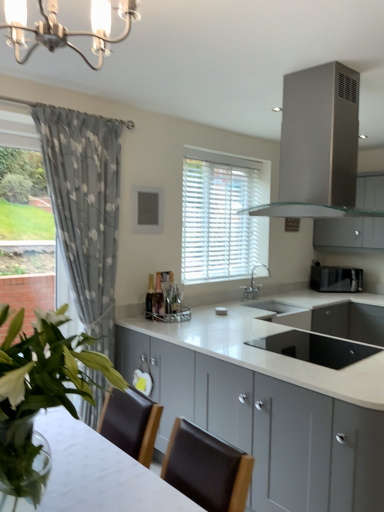
Question: From the image's perspective, does stainless steel range hood at upper center appear lower than black matte toaster at right, which is the second appliance in front-to-back order?

Choices:
 (A) yes
 (B) no

Answer: (B)

Question: Is stainless steel range hood at upper center shorter than black matte toaster at right, the 2th appliance positioned from the bottom?

Choices:
 (A) yes
 (B) no

Answer: (B)

Question: Is stainless steel range hood at upper center smaller than black matte toaster at right, which is the second appliance in front-to-back order?

Choices:
 (A) no
 (B) yes

Answer: (A)

Question: Does stainless steel range hood at upper center have a lesser width compared to black matte toaster at right, the second appliance positioned from the left?

Choices:
 (A) no
 (B) yes

Answer: (A)

Question: Is black matte toaster at right, the first appliance positioned from the top, completely or partially inside stainless steel range hood at upper center?

Choices:
 (A) no
 (B) yes

Answer: (A)

Question: Is stainless steel range hood at upper center taller than black matte toaster at right, the first appliance positioned from the top?

Choices:
 (A) no
 (B) yes

Answer: (B)

Question: Is black matte toaster at right, which is the second appliance in front-to-back order, facing away from white glossy cabinets at center, the first cabinetry when ordered from front to back?

Choices:
 (A) yes
 (B) no

Answer: (B)

Question: Is black matte toaster at right, which is the second appliance in front-to-back order, behind white glossy cabinets at center, the 1th cabinetry from the left?

Choices:
 (A) yes
 (B) no

Answer: (A)

Question: Can you confirm if black matte toaster at right, which is the 1th appliance from back to front, is thinner than white glossy cabinets at center, the first cabinetry when ordered from front to back?

Choices:
 (A) yes
 (B) no

Answer: (A)

Question: From a real-world perspective, is black matte toaster at right, the second appliance positioned from the left, below white glossy cabinets at center, which is the 2th cabinetry from top to bottom?

Choices:
 (A) no
 (B) yes

Answer: (A)

Question: From a real-world perspective, is black matte toaster at right, marked as the 1th appliance in a right-to-left arrangement, on top of white glossy cabinets at center, the first cabinetry when ordered from front to back?

Choices:
 (A) no
 (B) yes

Answer: (B)

Question: Considering the relative sizes of black matte toaster at right, which is the 1th appliance from back to front, and white glossy cabinets at center, the 1th cabinetry from the left, in the image provided, is black matte toaster at right, which is the 1th appliance from back to front, smaller than white glossy cabinets at center, the 1th cabinetry from the left,?

Choices:
 (A) yes
 (B) no

Answer: (A)

Question: Considering the relative sizes of stainless steel range hood at upper center and satin silver cabinet at upper right, placed as the first cabinetry when sorted from top to bottom, in the image provided, is stainless steel range hood at upper center taller than satin silver cabinet at upper right, placed as the first cabinetry when sorted from top to bottom,?

Choices:
 (A) yes
 (B) no

Answer: (B)